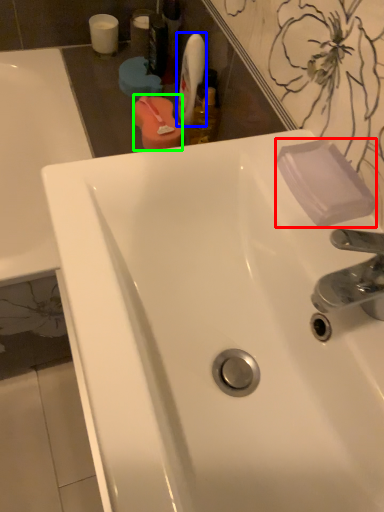
Question: Which is nearer to the soap (highlighted by a red box)? mouthwash (highlighted by a blue box) or mouthwash (highlighted by a green box).

Choices:
 (A) mouthwash
 (B) mouthwash

Answer: (B)